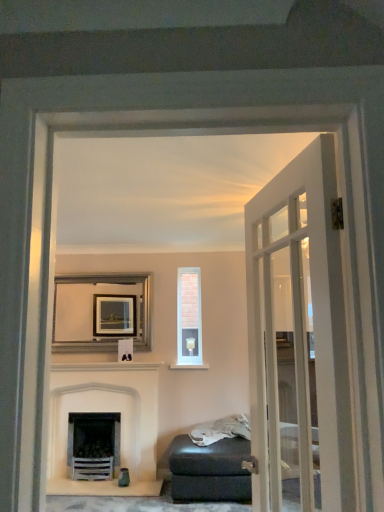
The image size is (384, 512). I want to click on white glass door at right, so click(x=297, y=337).

Is white brick wall at center positioned far away from white glass door at right?

white brick wall at center is positioned a significant distance from white glass door at right.

Does white brick wall at center turn towards white glass door at right?

Yes, white brick wall at center is oriented towards white glass door at right.

Is white brick wall at center not within white glass door at right?

Absolutely, white brick wall at center is external to white glass door at right.

Between white glass door at right and white stone fireplace at lower left, which one has less height?

With less height is white stone fireplace at lower left.

Which point is more forward, (299, 375) or (128, 407)?

The point (299, 375) is closer.

Is white glass door at right oriented towards white stone fireplace at lower left?

No, white glass door at right does not turn towards white stone fireplace at lower left.

Would you say white glass door at right is to the left or to the right of white stone fireplace at lower left in the picture?

From the image, it's evident that white glass door at right is to the right of white stone fireplace at lower left.

From a real-world perspective, is white stone fireplace at lower left positioned under white brick wall at center based on gravity?

Yes, from a real-world perspective, white stone fireplace at lower left is under white brick wall at center.

Based on the photo, can you confirm if white stone fireplace at lower left is taller than white brick wall at center?

Correct, white stone fireplace at lower left is much taller as white brick wall at center.

Locate an element on the screen. The width and height of the screenshot is (384, 512). window behind the white stone fireplace at lower left is located at coordinates (189, 319).

From a real-world perspective, is white stone fireplace at lower left positioned over matte black ottoman at lower center based on gravity?

Yes, from a real-world perspective, white stone fireplace at lower left is over matte black ottoman at lower center

From the image's perspective, is white stone fireplace at lower left located above matte black ottoman at lower center?

Yes, from the image's perspective, white stone fireplace at lower left is above matte black ottoman at lower center.

Is white stone fireplace at lower left touching matte black ottoman at lower center?

No.

Considering the positions of point (154, 459) and point (245, 479), is point (154, 459) closer or farther from the camera than point (245, 479)?

Point (154, 459) is farther from the camera than point (245, 479).

Is white stone fireplace at lower left next to white glass door at right?

No, white stone fireplace at lower left is not making contact with white glass door at right.

Choose the correct answer: Is white stone fireplace at lower left inside white glass door at right or outside it?

white stone fireplace at lower left exists outside the volume of white glass door at right.

Does white stone fireplace at lower left appear on the left side of white glass door at right?

Yes, white stone fireplace at lower left is to the left of white glass door at right.

Locate an element on the screen. Image resolution: width=384 pixels, height=512 pixels. door on the right of white stone fireplace at lower left is located at coordinates click(x=297, y=337).

The image size is (384, 512). In order to click on studio couch in front of the silver metallic picture frame at center in this screenshot , I will do `click(210, 470)`.

How different are the orientations of matte black ottoman at lower center and silver metallic picture frame at center in degrees?

matte black ottoman at lower center and silver metallic picture frame at center are facing 0.305 degrees away from each other.

Which point is more forward, (238, 450) or (104, 285)?

Positioned in front is point (238, 450).

Can you confirm if matte black ottoman at lower center is thinner than silver metallic picture frame at center?

No.

Is silver metallic picture frame at center not within white stone fireplace at lower left?

That's correct, silver metallic picture frame at center is outside of white stone fireplace at lower left.

Can you confirm if silver metallic picture frame at center is positioned to the right of white stone fireplace at lower left?

A: In fact, silver metallic picture frame at center is to the left of white stone fireplace at lower left.

How many degrees apart are the facing directions of silver metallic picture frame at center and white stone fireplace at lower left?

The facing directions of silver metallic picture frame at center and white stone fireplace at lower left are 0.369 degrees apart.

Is silver metallic picture frame at center directly adjacent to white stone fireplace at lower left?

They are not placed beside each other.

There is a white glass door at right. What are the coordinates of `window above it (from a real-world perspective)` in the screenshot? It's located at (189, 319).

You are a GUI agent. You are given a task and a screenshot of the screen. Output one action in this format:
    pyautogui.click(x=<x>, y=<y>)
    Task: Click on the door in front of the white stone fireplace at lower left
    
    Given the screenshot: What is the action you would take?
    pyautogui.click(x=297, y=337)

Based on their spatial positions, is white stone fireplace at lower left or white brick wall at center closer to white glass door at right?

Based on the image, white brick wall at center appears to be nearer to white glass door at right.

Consider the image. When comparing their distances from silver metallic picture frame at center, does matte black ottoman at lower center or white glass door at right seem further?

white glass door at right.

When comparing their distances from silver metallic picture frame at center, does white brick wall at center or white glass door at right seem closer?

white brick wall at center lies closer to silver metallic picture frame at center than the other object.

Consider the image. When comparing their distances from matte black ottoman at lower center, does white stone fireplace at lower left or white brick wall at center seem further?

white brick wall at center lies further to matte black ottoman at lower center than the other object.

From the image, which object appears to be nearer to white stone fireplace at lower left, silver metallic picture frame at center or white glass door at right?

The object closer to white stone fireplace at lower left is silver metallic picture frame at center.

Looking at the image, which one is located further to white stone fireplace at lower left, matte black ottoman at lower center or silver metallic picture frame at center?

Based on the image, matte black ottoman at lower center appears to be further to white stone fireplace at lower left.

Considering their positions, is silver metallic picture frame at center positioned closer to white brick wall at center than white stone fireplace at lower left?

silver metallic picture frame at center lies closer to white brick wall at center than the other object.

Which object lies nearer to the anchor point white glass door at right, white brick wall at center or matte black ottoman at lower center?

The object closer to white glass door at right is matte black ottoman at lower center.

Locate an element on the screen. The width and height of the screenshot is (384, 512). picture frame between white glass door at right and white brick wall at center in the front-back direction is located at coordinates (101, 312).

Where is `fireplace between silver metallic picture frame at center and matte black ottoman at lower center in the up-down direction`? This screenshot has height=512, width=384. fireplace between silver metallic picture frame at center and matte black ottoman at lower center in the up-down direction is located at coordinates (104, 412).

Where is `studio couch located between white glass door at right and white brick wall at center in the depth direction`? studio couch located between white glass door at right and white brick wall at center in the depth direction is located at coordinates (210, 470).

The image size is (384, 512). What are the coordinates of `studio couch between white glass door at right and white stone fireplace at lower left along the z-axis` in the screenshot? It's located at (210, 470).